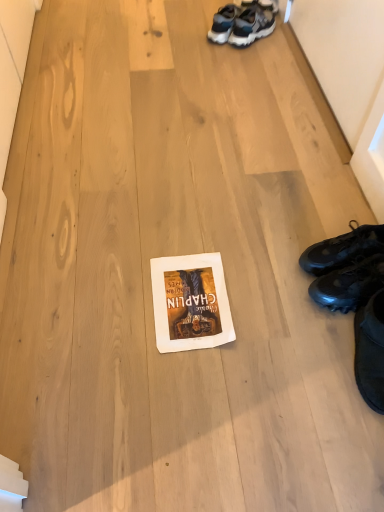
Question: Is black leather shoes at right, which is counted as the first footwear, starting from the top, facing away from white paper at center?

Choices:
 (A) no
 (B) yes

Answer: (A)

Question: Is black leather shoes at right, which is counted as the first footwear, starting from the top, next to white paper at center?

Choices:
 (A) yes
 (B) no

Answer: (B)

Question: Is black leather shoes at right, which is counted as the first footwear, starting from the top, further to camera compared to white paper at center?

Choices:
 (A) no
 (B) yes

Answer: (B)

Question: Does black leather shoes at right, the second footwear when ordered from bottom to top, have a larger size compared to white paper at center?

Choices:
 (A) yes
 (B) no

Answer: (A)

Question: Considering the relative positions of black leather shoes at right, which is counted as the first footwear, starting from the top, and white paper at center in the image provided, is black leather shoes at right, which is counted as the first footwear, starting from the top, to the right of white paper at center from the viewer's perspective?

Choices:
 (A) yes
 (B) no

Answer: (A)

Question: Considering the relative sizes of black leather shoes at right, the second footwear when ordered from bottom to top, and white paper at center in the image provided, is black leather shoes at right, the second footwear when ordered from bottom to top, wider than white paper at center?

Choices:
 (A) no
 (B) yes

Answer: (A)

Question: From a real-world perspective, is black leather shoes at right, which is counted as the first footwear, starting from the top, located beneath black matte sneakers at lower right, arranged as the 2th footwear when viewed from the top?

Choices:
 (A) no
 (B) yes

Answer: (B)

Question: Considering the relative positions of black leather shoes at right, which is counted as the first footwear, starting from the top, and black matte sneakers at lower right, arranged as the 2th footwear when viewed from the top, in the image provided, is black leather shoes at right, which is counted as the first footwear, starting from the top, to the left of black matte sneakers at lower right, arranged as the 2th footwear when viewed from the top, from the viewer's perspective?

Choices:
 (A) yes
 (B) no

Answer: (A)

Question: Can you confirm if black leather shoes at right, which is counted as the first footwear, starting from the top, is wider than black matte sneakers at lower right, acting as the first footwear starting from the bottom?

Choices:
 (A) no
 (B) yes

Answer: (B)

Question: From a real-world perspective, is black leather shoes at right, which is counted as the first footwear, starting from the top, on top of black matte sneakers at lower right, arranged as the 2th footwear when viewed from the top?

Choices:
 (A) no
 (B) yes

Answer: (A)

Question: Is black leather shoes at right, the second footwear when ordered from bottom to top, taller than black matte sneakers at lower right, arranged as the 2th footwear when viewed from the top?

Choices:
 (A) yes
 (B) no

Answer: (B)

Question: Could you tell me if black leather shoes at right, which is counted as the first footwear, starting from the top, is facing black matte sneakers at lower right, arranged as the 2th footwear when viewed from the top?

Choices:
 (A) no
 (B) yes

Answer: (A)

Question: Is white paper at center not within black matte sneakers at lower right, acting as the first footwear starting from the bottom?

Choices:
 (A) no
 (B) yes

Answer: (B)